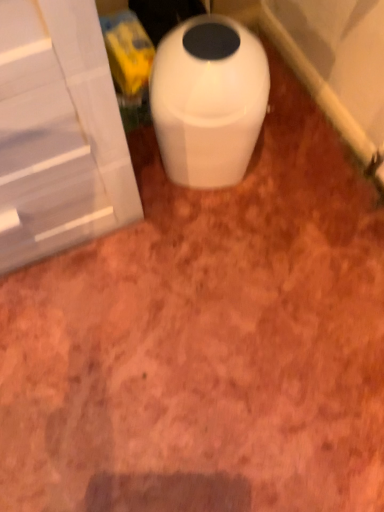
What do you see at coordinates (208, 100) in the screenshot?
I see `white glossy trash can at center` at bounding box center [208, 100].

What is the approximate height of white glossy trash can at center?

white glossy trash can at center is 45.00 centimeters in height.

Find the location of `white glossy trash can at center`. white glossy trash can at center is located at coordinates (208, 100).

This screenshot has width=384, height=512. Describe the element at coordinates (58, 132) in the screenshot. I see `white glossy screen door at left` at that location.

Image resolution: width=384 pixels, height=512 pixels. In order to click on white glossy screen door at left in this screenshot , I will do `click(58, 132)`.

You are a GUI agent. You are given a task and a screenshot of the screen. Output one action in this format:
    pyautogui.click(x=<x>, y=<y>)
    Task: Click on the white glossy trash can at center
    The image size is (384, 512).
    Given the screenshot: What is the action you would take?
    pyautogui.click(x=208, y=100)

Considering the relative positions of white glossy screen door at left and white glossy trash can at center in the image provided, is white glossy screen door at left to the left of white glossy trash can at center from the viewer's perspective?

Correct, you'll find white glossy screen door at left to the left of white glossy trash can at center.

Based on the photo, is white glossy screen door at left behind white glossy trash can at center?

No, white glossy screen door at left is in front of white glossy trash can at center.

Is point (41, 197) less distant than point (255, 74)?

Yes.

From the image's perspective, between white glossy screen door at left and white glossy trash can at center, which one is located above?

white glossy screen door at left is shown above in the image.

From a real-world perspective, between white glossy screen door at left and white glossy trash can at center, who is vertically higher?

Result: In real-world perspective, white glossy screen door at left is above.

Between white glossy screen door at left and white glossy trash can at center, which one has smaller width?

white glossy trash can at center is thinner.

Considering the sizes of objects white glossy screen door at left and white glossy trash can at center in the image provided, who is taller, white glossy screen door at left or white glossy trash can at center?

Standing taller between the two is white glossy screen door at left.

Considering the sizes of white glossy screen door at left and white glossy trash can at center in the image, is white glossy screen door at left bigger or smaller than white glossy trash can at center?

Considering their sizes, white glossy screen door at left takes up more space than white glossy trash can at center.

Looking at this image, would you say white glossy screen door at left is outside white glossy trash can at center?

white glossy screen door at left lies outside white glossy trash can at center's area.

Is white glossy screen door at left next to white glossy trash can at center and touching it?

white glossy screen door at left and white glossy trash can at center are not in contact.

Could you tell me if white glossy screen door at left is turned towards white glossy trash can at center?

No, white glossy screen door at left is not oriented towards white glossy trash can at center.

What are the coordinates of `screen door located in front of the white glossy trash can at center` in the screenshot? It's located at pyautogui.click(x=58, y=132).

Based on the photo, which object is positioned more to the right, white glossy trash can at center or white glossy screen door at left?

white glossy trash can at center.

Is the depth of white glossy trash can at center greater than that of white glossy screen door at left?

Yes, the depth of white glossy trash can at center is greater than that of white glossy screen door at left.

Which is farther, (156, 121) or (68, 0)?

The point (156, 121) is more distant.

From the image's perspective, is white glossy trash can at center over white glossy screen door at left?

No, from the image's perspective, white glossy trash can at center is not above white glossy screen door at left.

From a real-world perspective, is white glossy trash can at center positioned under white glossy screen door at left based on gravity?

Yes.

In terms of width, does white glossy trash can at center look wider or thinner when compared to white glossy screen door at left?

white glossy trash can at center is thinner than white glossy screen door at left.

Which of these two, white glossy trash can at center or white glossy screen door at left, stands shorter?

With less height is white glossy trash can at center.

Looking at this image, does white glossy trash can at center have a larger size compared to white glossy screen door at left?

No, white glossy trash can at center is not bigger than white glossy screen door at left.

Is white glossy trash can at center not within white glossy screen door at left?

Yes, white glossy trash can at center is located beyond the bounds of white glossy screen door at left.

Is there a large distance between white glossy trash can at center and white glossy screen door at left?

white glossy trash can at center is near white glossy screen door at left, not far away.

Is white glossy trash can at center looking in the opposite direction of white glossy screen door at left?

No, white glossy screen door at left is not at the back of white glossy trash can at center.

What's the angular difference between white glossy trash can at center and white glossy screen door at left's facing directions?

The facing directions of white glossy trash can at center and white glossy screen door at left are 0.228 degrees apart.

How much distance is there between white glossy trash can at center and white glossy screen door at left?

white glossy trash can at center is 10.56 inches from white glossy screen door at left.

Image resolution: width=384 pixels, height=512 pixels. In order to click on screen door on the left of white glossy trash can at center in this screenshot , I will do `click(58, 132)`.

Identify the location of waste container below the white glossy screen door at left (from the image's perspective). (208, 100).

Find the location of `screen door on the left of white glossy trash can at center`. screen door on the left of white glossy trash can at center is located at coordinates (58, 132).